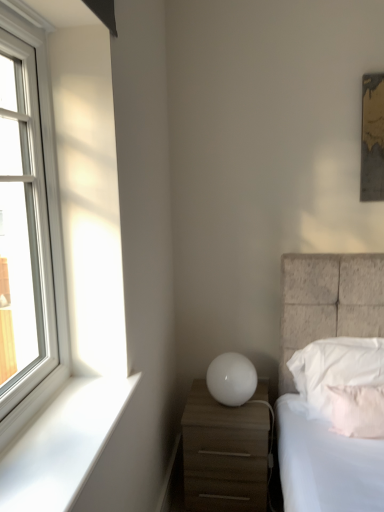
Find the location of a particular element. The width and height of the screenshot is (384, 512). vacant region to the left of white glossy sphere at center is located at coordinates (196, 404).